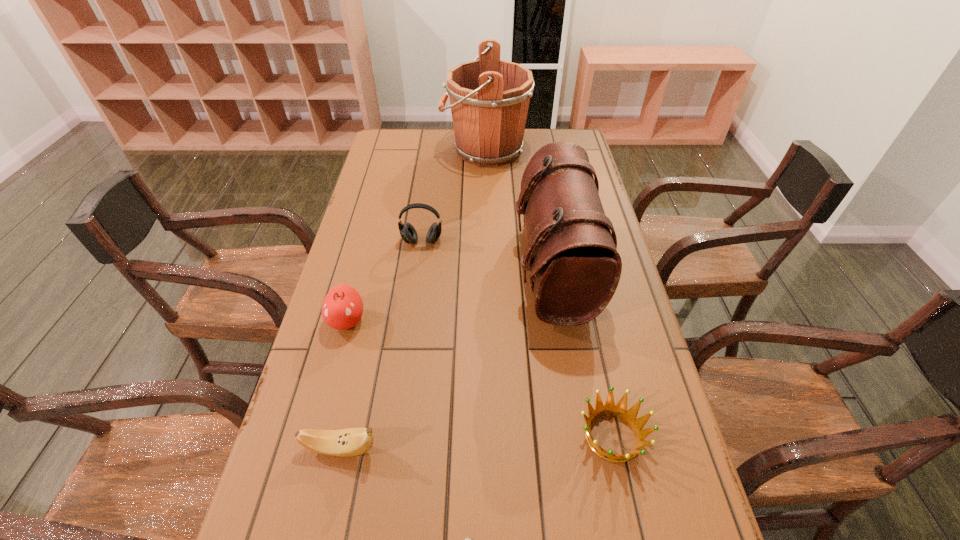
Identify the location of bucket. (489, 98).

Find the location of `the farthest object`. the farthest object is located at coordinates (489, 98).

Where is `the sixth shortest object`? The image size is (960, 540). the sixth shortest object is located at coordinates (572, 256).

At what (x,y) coordinates should I click in order to perform the action: click on headset. Please return your answer as a coordinate pair (x, y). The image size is (960, 540). Looking at the image, I should click on (408, 233).

I want to click on apple, so (342, 308).

I want to click on banana, so click(349, 442).

The width and height of the screenshot is (960, 540). Identify the location of crown. (619, 410).

Locate an element on the screen. The image size is (960, 540). vacant space situated 0.080m with the handle on the side of the bucket is located at coordinates (421, 150).

Find the location of a particular element. The image size is (960, 540). free region located with the handle on the side of the bucket is located at coordinates (413, 150).

The image size is (960, 540). Find the location of `free space located with the handle on the side of the bucket`. free space located with the handle on the side of the bucket is located at coordinates (377, 150).